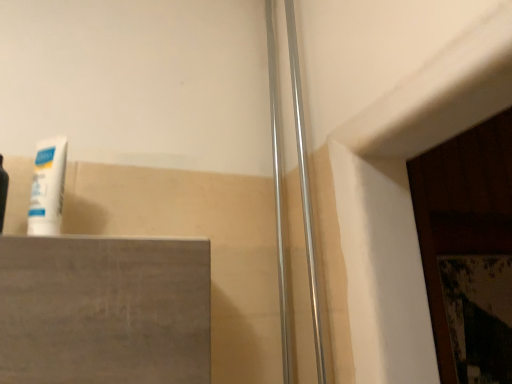
Question: Does satin silver shower door at center appear on the left side of white matte tube at left?

Choices:
 (A) no
 (B) yes

Answer: (A)

Question: From the image's perspective, is satin silver shower door at center above white matte tube at left?

Choices:
 (A) yes
 (B) no

Answer: (A)

Question: Does satin silver shower door at center come behind white matte tube at left?

Choices:
 (A) yes
 (B) no

Answer: (A)

Question: From the image's perspective, does satin silver shower door at center appear lower than white matte tube at left?

Choices:
 (A) no
 (B) yes

Answer: (A)

Question: Is satin silver shower door at center next to white matte tube at left?

Choices:
 (A) yes
 (B) no

Answer: (B)

Question: Is satin silver shower door at center shorter than white matte tube at left?

Choices:
 (A) no
 (B) yes

Answer: (A)

Question: Does white matte tube at left have a smaller size compared to satin silver shower door at center?

Choices:
 (A) yes
 (B) no

Answer: (B)

Question: Is there a large distance between white matte tube at left and satin silver shower door at center?

Choices:
 (A) no
 (B) yes

Answer: (A)

Question: Is white matte tube at left oriented towards satin silver shower door at center?

Choices:
 (A) yes
 (B) no

Answer: (B)

Question: Can you confirm if white matte tube at left is thinner than satin silver shower door at center?

Choices:
 (A) no
 (B) yes

Answer: (A)

Question: Considering the relative sizes of white matte tube at left and satin silver shower door at center in the image provided, is white matte tube at left taller than satin silver shower door at center?

Choices:
 (A) no
 (B) yes

Answer: (A)

Question: Is white matte tube at left oriented away from satin silver shower door at center?

Choices:
 (A) yes
 (B) no

Answer: (B)

Question: Is white matte tube at left bigger or smaller than satin silver shower door at center?

Choices:
 (A) small
 (B) big

Answer: (B)